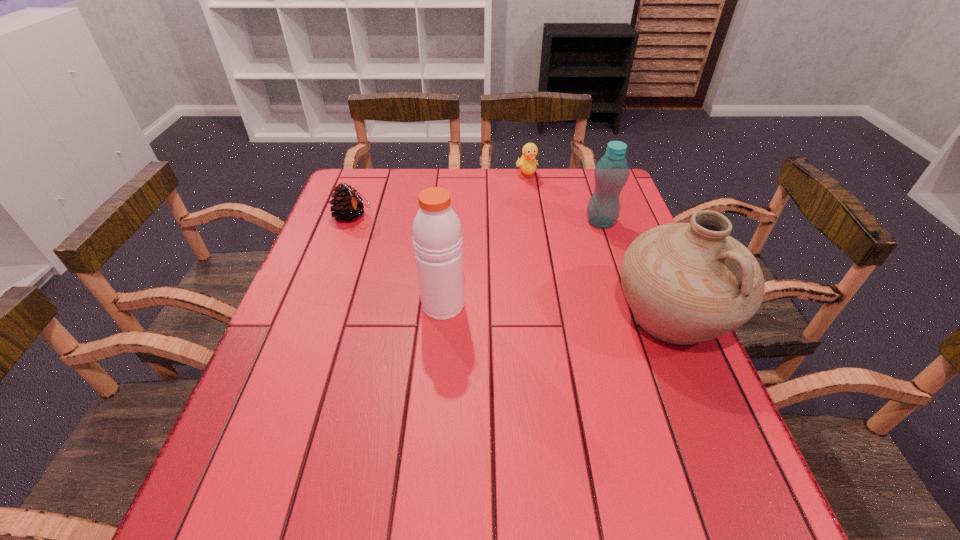
The width and height of the screenshot is (960, 540). I want to click on pottery located in the right edge section of the desktop, so [x=690, y=282].

The width and height of the screenshot is (960, 540). I want to click on water bottle at the right edge, so click(x=611, y=172).

I want to click on object that is positioned at the far left corner, so point(348,204).

This screenshot has height=540, width=960. Find the location of `vacant space at the far edge of the desktop`. vacant space at the far edge of the desktop is located at coordinates (504, 207).

In the image, there is a desktop. Where is `vacant space at the near edge`? vacant space at the near edge is located at coordinates (427, 457).

The height and width of the screenshot is (540, 960). I want to click on vacant area at the left edge, so click(338, 245).

You are a GUI agent. You are given a task and a screenshot of the screen. Output one action in this format:
    pyautogui.click(x=<x>, y=<y>)
    Task: Click on the vacant region at the right edge
    The image size is (960, 540).
    Given the screenshot: What is the action you would take?
    pyautogui.click(x=632, y=241)

In the image, there is a desktop. Where is `vacant space at the far left corner`? This screenshot has height=540, width=960. vacant space at the far left corner is located at coordinates (366, 170).

What are the coordinates of `free space between the water bottle and the shaker` in the screenshot? It's located at (521, 264).

Identify the location of vacant region between the shaker and the leftmost object. (397, 260).